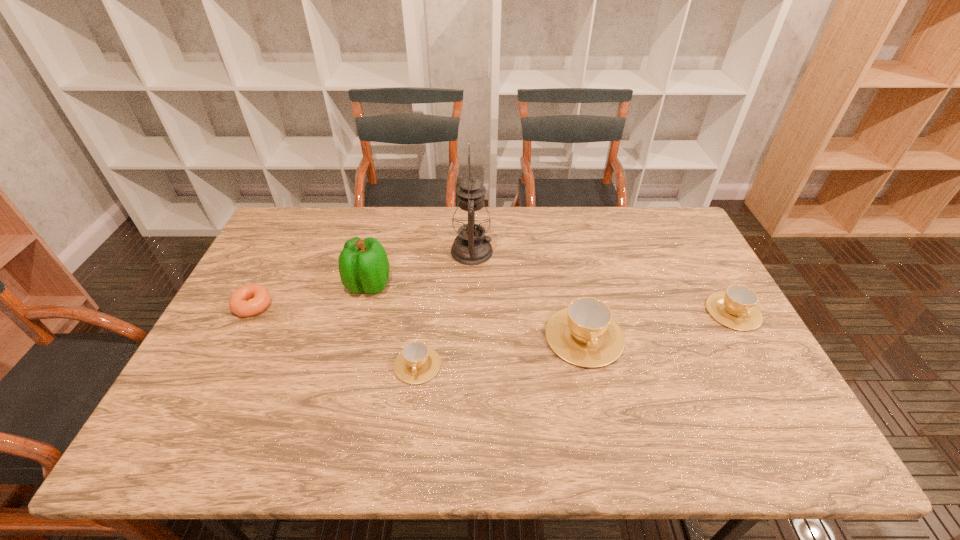
In order to click on the second object from left to right in this screenshot , I will do `click(363, 265)`.

At what (x,y) coordinates should I click in order to perform the action: click on vacant position located 0.050m with the handle on the side of the leftmost cup. Please return your answer as a coordinate pair (x, y). Looking at the image, I should click on (413, 403).

The image size is (960, 540). I want to click on blank area located with the handle on the side of the tallest cup, so click(597, 397).

Where is `vacant region located 0.050m with the handle on the side of the third shortest object`? This screenshot has width=960, height=540. vacant region located 0.050m with the handle on the side of the third shortest object is located at coordinates (753, 347).

The image size is (960, 540). Identify the location of blank space located 0.340m on the front of the fourth object from left to right. (469, 355).

Identify the location of free space located on the back of the doughnut. (290, 233).

Find the location of a particular element. The image size is (960, 540). vacant space located on the right of the second object from left to right is located at coordinates (499, 285).

Where is `object that is positioned at the far edge`? object that is positioned at the far edge is located at coordinates (471, 220).

Image resolution: width=960 pixels, height=540 pixels. Identify the location of object present at the near edge. (417, 363).

At what (x,y) coordinates should I click in order to perform the action: click on object positioned at the left edge. Please return your answer as a coordinate pair (x, y). The image size is (960, 540). Looking at the image, I should click on (259, 297).